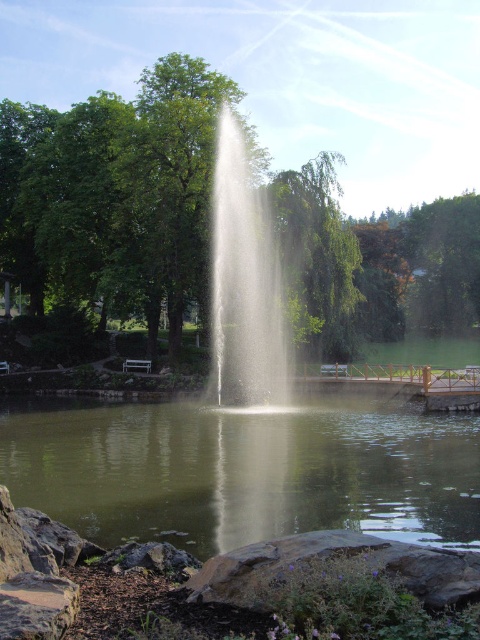
Question: From the image, what is the correct spatial relationship of clear water at center in relation to white misty fountain at center?

Choices:
 (A) above
 (B) below

Answer: (B)

Question: Which object is positioned closest to the wooden bench at center?

Choices:
 (A) white misty fountain at center
 (B) clear water at center

Answer: (A)

Question: Among these points, which one is farthest from the camera?

Choices:
 (A) click(x=127, y=360)
 (B) click(x=238, y=346)
 (C) click(x=87, y=515)

Answer: (A)

Question: Where is clear water at center located in relation to white misty fountain at center in the image?

Choices:
 (A) below
 (B) above

Answer: (A)

Question: Does white misty fountain at center have a smaller size compared to wooden bench at center?

Choices:
 (A) no
 (B) yes

Answer: (A)

Question: Which object is positioned closest to the white misty fountain at center?

Choices:
 (A) clear water at center
 (B) wooden bench at center

Answer: (B)